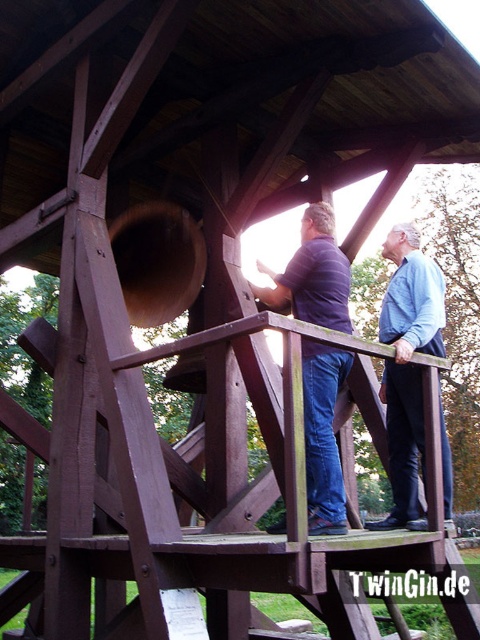
You are standing at the point marked as point (323, 436) in the bell tower. What color is the shirt of the person closest to you?

The point (323, 436) is on matte blue shirt at center, so the closest person to you is wearing a matte blue shirt.

You are an architect designing a new bell tower and need to ensure the platform railing height is safe for visitors. The safety guideline requires that the railing must be at least as tall as the tallest object among the matte blue shirt at center and blue denim jeans at upper center. Based on the image, which object determines the minimum required railing height?

The blue denim jeans at upper center is taller than the matte blue shirt at center, so the railing must be at least as tall as the blue denim jeans at upper center to meet safety guidelines.